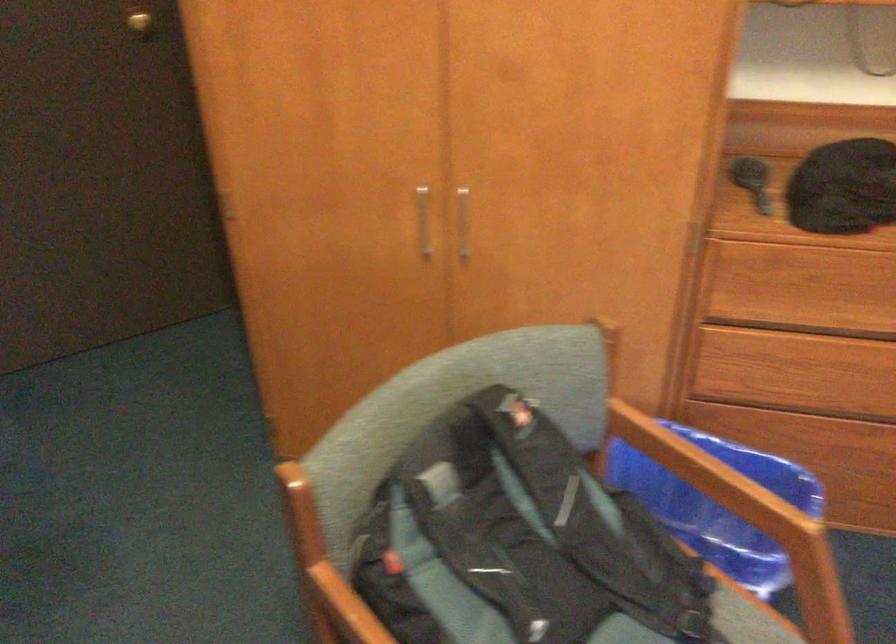
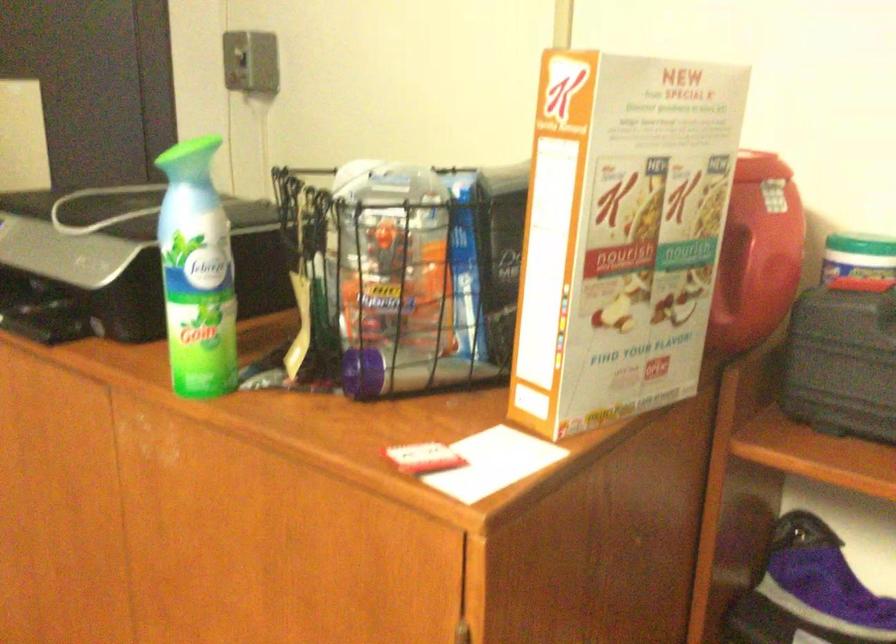
Which direction would the cameraman need to move to produce the second image?

The movement direction of the cameraman is right, forward.